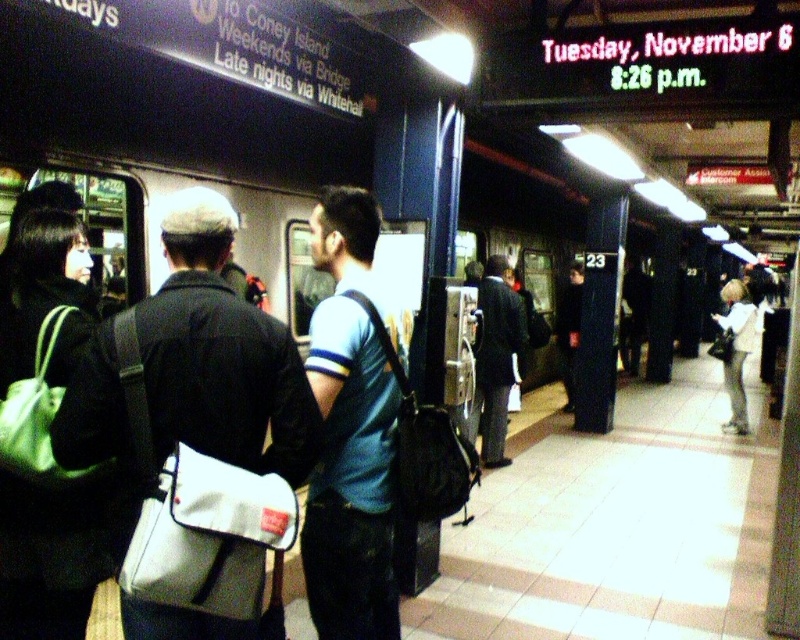
You are an observer at the subway station. You notice a white fabric bag at center and a light beige jacket at right. Which object takes up more area in the image?

The light beige jacket at right occupies more space than the white fabric bag at center.